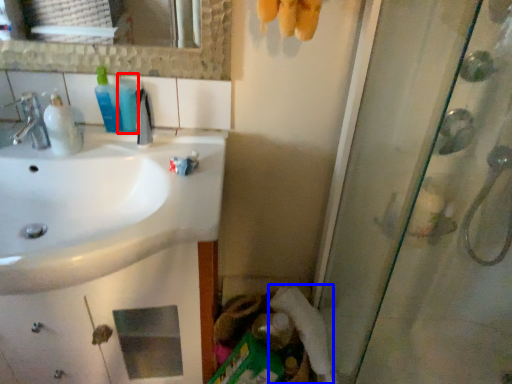
Question: Among these objects, which one is farthest to the camera, mouthwash (highlighted by a red box) or toilet paper (highlighted by a blue box)?

Choices:
 (A) mouthwash
 (B) toilet paper

Answer: (B)